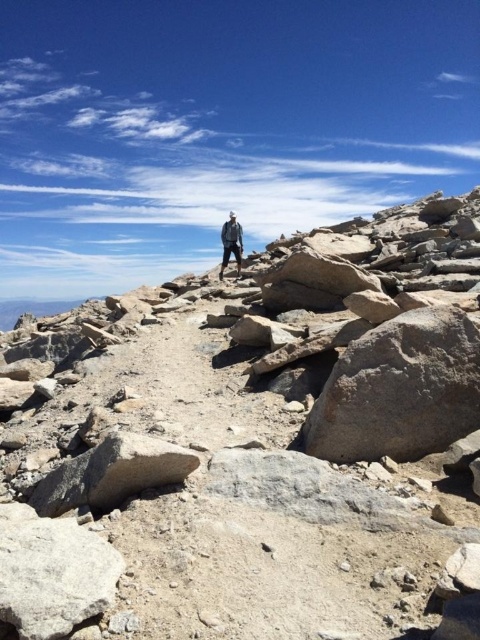
You are a hiker standing at the point with coordinates point (239, 241). You want to reach the point with coordinates point (424, 481). Which direction should you move relative to your current position?

You should move forward because point (424, 481) is in front of point (239, 241).

You are a hiker who wants to pick up the gray rock at center and the denim jacket at center. Which object is located to the right of the other?

The gray rock at center is positioned on the right side of denim jacket at center.

You are standing at the origin point of the coordinate system in the image. You want to move towards the gray rock at center. What direction should you move in?

The gray rock at center is located at coordinate point 0.697 on the x axis and 0.523 on the y axis. Since you are at the origin point, you should move towards the positive x and positive y direction to reach the gray rock at center.